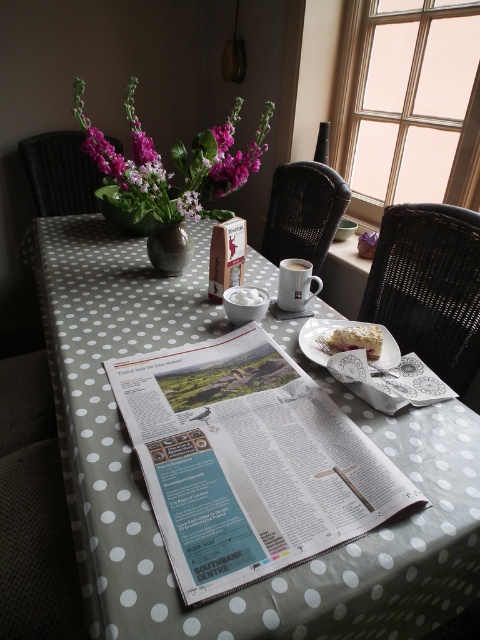
Is white printed newspaper at center positioned in front of white fluffy sugar at center?

Yes, it is in front of white fluffy sugar at center.

Is white printed newspaper at center taller than white fluffy sugar at center?

Indeed, white printed newspaper at center has a greater height compared to white fluffy sugar at center.

Which is in front, point (305, 412) or point (236, 296)?

Positioned in front is point (305, 412).

You are a GUI agent. You are given a task and a screenshot of the screen. Output one action in this format:
    pyautogui.click(x=<x>, y=<y>)
    Task: Click on the white printed newspaper at center
    
    Given the screenshot: What is the action you would take?
    pyautogui.click(x=248, y=460)

Which is behind, point (178, 209) or point (288, 314)?

The point (178, 209) is more distant.

The width and height of the screenshot is (480, 640). I want to click on purple matte flower at center, so click(189, 205).

This screenshot has height=640, width=480. I want to click on purple matte flower at center, so click(x=189, y=205).

Is point (257, 301) less distant than point (278, 314)?

Yes, point (257, 301) is in front of point (278, 314).

Based on the photo, can you confirm if white fluffy sugar at center is bigger than white ceramic saucer at center?

Actually, white fluffy sugar at center might be smaller than white ceramic saucer at center.

Is point (231, 298) less distant than point (284, 317)?

Yes, point (231, 298) is in front of point (284, 317).

This screenshot has width=480, height=640. What are the coordinates of `white fluffy sugar at center` in the screenshot? It's located at (247, 296).